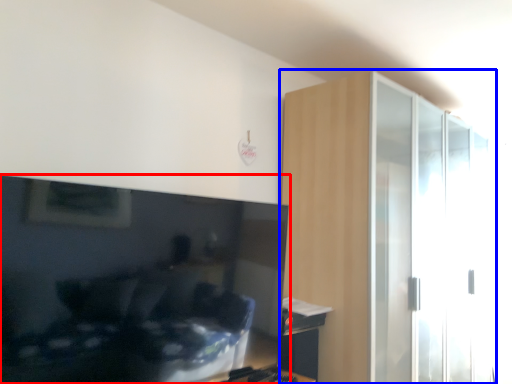
Question: Which point is further to the camera, television (highlighted by a red box) or dresser (highlighted by a blue box)?

Choices:
 (A) television
 (B) dresser

Answer: (B)